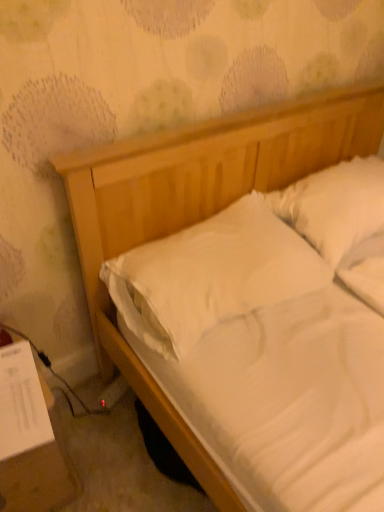
Question: Does white paper at lower left have a larger size compared to white soft pillow at center, which ranks as the 2th pillow in right-to-left order?

Choices:
 (A) no
 (B) yes

Answer: (A)

Question: Considering the relative positions of white paper at lower left and white soft pillow at center, which appears as the first pillow when viewed from the left, in the image provided, is white paper at lower left to the right of white soft pillow at center, which appears as the first pillow when viewed from the left, from the viewer's perspective?

Choices:
 (A) no
 (B) yes

Answer: (A)

Question: Is white paper at lower left facing towards white soft pillow at center, which appears as the first pillow when viewed from the left?

Choices:
 (A) yes
 (B) no

Answer: (B)

Question: From the image's perspective, would you say white paper at lower left is positioned over white soft pillow at center, which appears as the first pillow when viewed from the left?

Choices:
 (A) no
 (B) yes

Answer: (A)

Question: Would you say white soft pillow at center, which appears as the first pillow when viewed from the left, is part of white paper at lower left's contents?

Choices:
 (A) no
 (B) yes

Answer: (A)

Question: From a real-world perspective, is white soft pillow at upper right, the 2th pillow in the left-to-right sequence, positioned above or below white soft pillow at center, which ranks as the 2th pillow in right-to-left order?

Choices:
 (A) below
 (B) above

Answer: (B)

Question: Is white soft pillow at upper right, which is counted as the first pillow, starting from the right, taller or shorter than white soft pillow at center, which ranks as the 2th pillow in right-to-left order?

Choices:
 (A) tall
 (B) short

Answer: (A)

Question: Based on their sizes in the image, would you say white soft pillow at upper right, the 2th pillow in the left-to-right sequence, is bigger or smaller than white soft pillow at center, which appears as the first pillow when viewed from the left?

Choices:
 (A) small
 (B) big

Answer: (A)

Question: Considering the positions of white soft pillow at upper right, the 2th pillow in the left-to-right sequence, and white soft pillow at center, which appears as the first pillow when viewed from the left, in the image, is white soft pillow at upper right, the 2th pillow in the left-to-right sequence, wider or thinner than white soft pillow at center, which appears as the first pillow when viewed from the left,?

Choices:
 (A) wide
 (B) thin

Answer: (B)

Question: In terms of size, does white paper at lower left appear bigger or smaller than white soft pillow at center, which appears as the first pillow when viewed from the left?

Choices:
 (A) big
 (B) small

Answer: (B)

Question: Is white paper at lower left situated inside white soft pillow at center, which ranks as the 2th pillow in right-to-left order, or outside?

Choices:
 (A) inside
 (B) outside

Answer: (B)

Question: From their relative heights in the image, would you say white paper at lower left is taller or shorter than white soft pillow at center, which appears as the first pillow when viewed from the left?

Choices:
 (A) short
 (B) tall

Answer: (B)

Question: Is white paper at lower left to the left or to the right of white soft pillow at center, which appears as the first pillow when viewed from the left, in the image?

Choices:
 (A) left
 (B) right

Answer: (A)

Question: Would you say white soft pillow at center, which appears as the first pillow when viewed from the left, is to the left or to the right of white paper at lower left in the picture?

Choices:
 (A) left
 (B) right

Answer: (B)

Question: From their relative heights in the image, would you say white soft pillow at center, which ranks as the 2th pillow in right-to-left order, is taller or shorter than white paper at lower left?

Choices:
 (A) short
 (B) tall

Answer: (A)